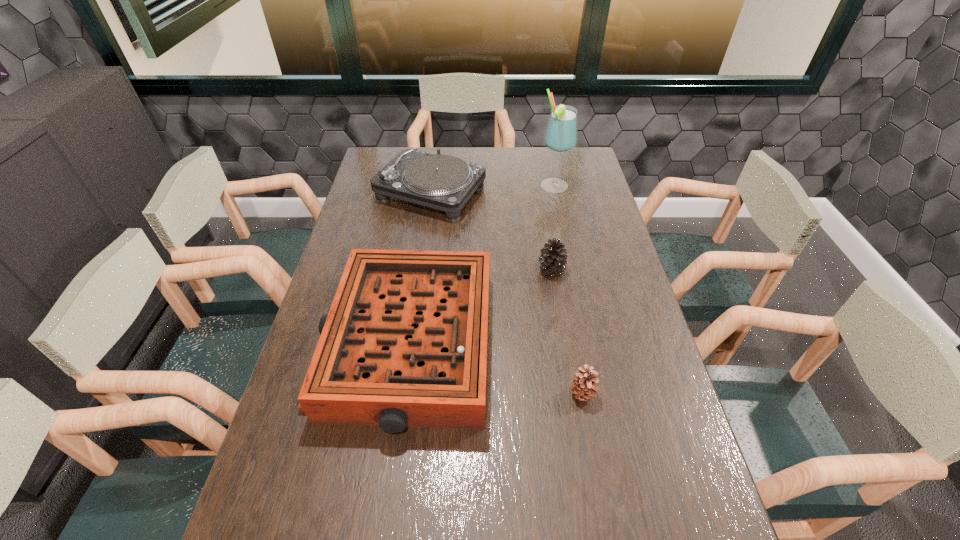
Identify which pinecone is the second closest to the gameboard. Please provide its 2D coordinates. Your answer should be formatted as a tuple, i.e. [(x, y)], where the tuple contains the x and y coordinates of a point satisfying the conditions above.

[(583, 387)]

At what (x,y) coordinates should I click in order to perform the action: click on free spot that satisfies the following two spatial constraints: 1. on the back side of the gameboard; 2. on the left side of the farther pinecone. Please return your answer as a coordinate pair (x, y). The height and width of the screenshot is (540, 960). Looking at the image, I should click on (417, 269).

The width and height of the screenshot is (960, 540). Find the location of `free space that satisfies the following two spatial constraints: 1. on the front side of the farther pinecone; 2. on the right side of the record player`. free space that satisfies the following two spatial constraints: 1. on the front side of the farther pinecone; 2. on the right side of the record player is located at coordinates (420, 269).

Where is `free space that satisfies the following two spatial constraints: 1. on the back side of the farther pinecone; 2. on the left side of the gameboard`? This screenshot has height=540, width=960. free space that satisfies the following two spatial constraints: 1. on the back side of the farther pinecone; 2. on the left side of the gameboard is located at coordinates (417, 269).

You are a GUI agent. You are given a task and a screenshot of the screen. Output one action in this format:
    pyautogui.click(x=<x>, y=<y>)
    Task: Click on the free spot that satisfies the following two spatial constraints: 1. on the front side of the shorter pinecone; 2. on the left side of the gameboard
    
    Given the screenshot: What is the action you would take?
    pyautogui.click(x=398, y=394)